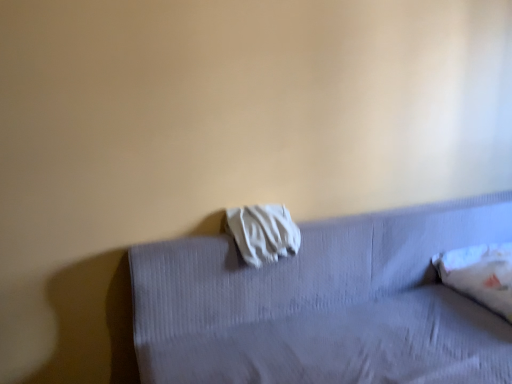
Question: Is white fabric at upper center a part of white soft pillow at right?

Choices:
 (A) no
 (B) yes

Answer: (A)

Question: From a real-world perspective, is white soft pillow at right below white fabric at upper center?

Choices:
 (A) yes
 (B) no

Answer: (B)

Question: Would you say white soft pillow at right is a long distance from white fabric at upper center?

Choices:
 (A) yes
 (B) no

Answer: (B)

Question: From the image's perspective, is white soft pillow at right under white fabric at upper center?

Choices:
 (A) no
 (B) yes

Answer: (A)

Question: Considering the relative sizes of white soft pillow at right and white fabric at upper center in the image provided, is white soft pillow at right thinner than white fabric at upper center?

Choices:
 (A) yes
 (B) no

Answer: (A)

Question: Is white soft pillow at right inside the boundaries of white fabric at center, or outside?

Choices:
 (A) inside
 (B) outside

Answer: (B)

Question: Looking at the image, does white soft pillow at right seem bigger or smaller compared to white fabric at center?

Choices:
 (A) big
 (B) small

Answer: (A)

Question: Is white soft pillow at right wider or thinner than white fabric at center?

Choices:
 (A) thin
 (B) wide

Answer: (B)

Question: From a real-world perspective, is white soft pillow at right positioned above or below white fabric at center?

Choices:
 (A) above
 (B) below

Answer: (B)

Question: From a real-world perspective, is white fabric at center positioned above or below white soft pillow at right?

Choices:
 (A) above
 (B) below

Answer: (A)

Question: Relative to white soft pillow at right, is white fabric at center in front or behind?

Choices:
 (A) front
 (B) behind

Answer: (A)

Question: In terms of size, does white fabric at center appear bigger or smaller than white soft pillow at right?

Choices:
 (A) small
 (B) big

Answer: (A)

Question: From the image's perspective, relative to white soft pillow at right, is white fabric at center above or below?

Choices:
 (A) above
 (B) below

Answer: (A)

Question: In terms of height, does white fabric at center look taller or shorter compared to white fabric at upper center?

Choices:
 (A) short
 (B) tall

Answer: (A)

Question: Is white fabric at center in front of or behind white fabric at upper center in the image?

Choices:
 (A) behind
 (B) front

Answer: (A)